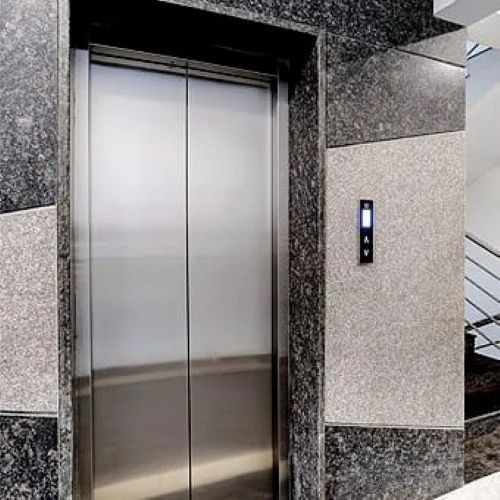
You are a GUI agent. You are given a task and a screenshot of the screen. Output one action in this format:
    pyautogui.click(x=<x>, y=<y>)
    Task: Click on the top edge of elevator button
    
    Given the screenshot: What is the action you would take?
    pyautogui.click(x=366, y=201)